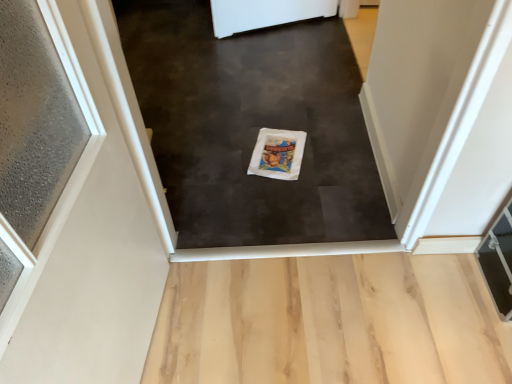
Question: Based on their sizes in the image, would you say white fabric bag at center is bigger or smaller than white textured door at left?

Choices:
 (A) small
 (B) big

Answer: (A)

Question: Which is correct: white fabric bag at center is inside white textured door at left, or outside of it?

Choices:
 (A) inside
 (B) outside

Answer: (B)

Question: In terms of height, does white fabric bag at center look taller or shorter compared to white textured door at left?

Choices:
 (A) tall
 (B) short

Answer: (A)

Question: Considering the positions of white textured door at left and white fabric bag at center in the image, is white textured door at left bigger or smaller than white fabric bag at center?

Choices:
 (A) big
 (B) small

Answer: (A)

Question: From the image's perspective, is white textured door at left positioned above or below white fabric bag at center?

Choices:
 (A) below
 (B) above

Answer: (A)

Question: Does point (11, 211) appear closer or farther from the camera than point (315, 34)?

Choices:
 (A) closer
 (B) farther

Answer: (A)

Question: Is white textured door at left inside or outside of white fabric bag at center?

Choices:
 (A) outside
 (B) inside

Answer: (A)